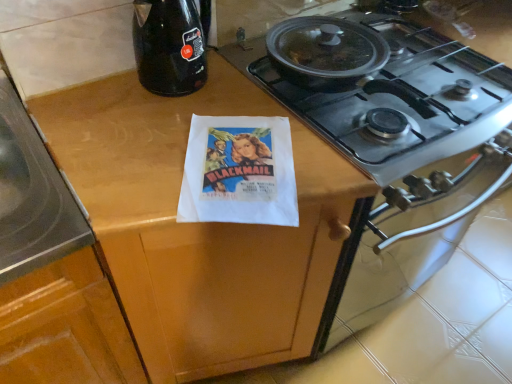
The image size is (512, 384). Find the location of `vacant space underneath black glass bottle at upper left (from a real-world perspective)`. vacant space underneath black glass bottle at upper left (from a real-world perspective) is located at coordinates (199, 85).